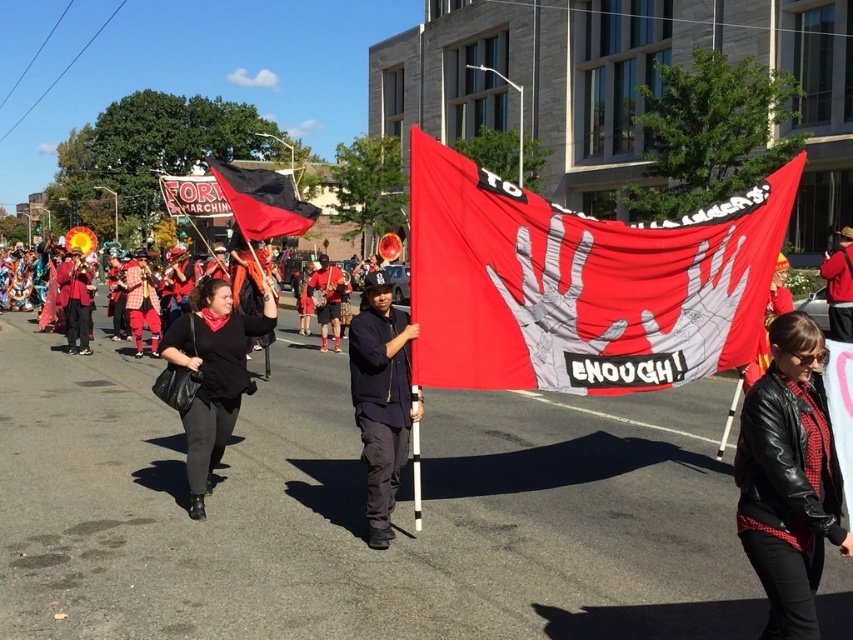
Who is higher up, red fabric banner at center or dark blue fabric jacket at center?

red fabric banner at center

Between red fabric banner at center and dark blue fabric jacket at center, which one is positioned lower?

dark blue fabric jacket at center is below.

The width and height of the screenshot is (853, 640). Describe the element at coordinates (581, 284) in the screenshot. I see `red fabric banner at center` at that location.

At what (x,y) coordinates should I click in order to perform the action: click on red fabric banner at center. Please return your answer as a coordinate pair (x, y). Looking at the image, I should click on (581, 284).

Is point (229, 404) positioned before point (328, 310)?

That is True.

Can you confirm if black matte shirt at center is positioned to the left of red fabric pants at center?

Incorrect, black matte shirt at center is not on the left side of red fabric pants at center.

Who is more forward, (201, 358) or (318, 282)?

Point (201, 358)

Locate an element on the screen. Image resolution: width=853 pixels, height=640 pixels. black matte shirt at center is located at coordinates (213, 374).

Who is more forward, (257,179) or (312,289)?

Point (257,179)

You are a GUI agent. You are given a task and a screenshot of the screen. Output one action in this format:
    pyautogui.click(x=<x>, y=<y>)
    Task: Click on the black fabric flag at center
    This screenshot has width=853, height=640.
    Given the screenshot: What is the action you would take?
    pyautogui.click(x=262, y=202)

Who is more distant from viewer, (305, 208) or (334, 284)?

Point (334, 284)

The width and height of the screenshot is (853, 640). Find the location of `black fabric flag at center`. black fabric flag at center is located at coordinates (262, 202).